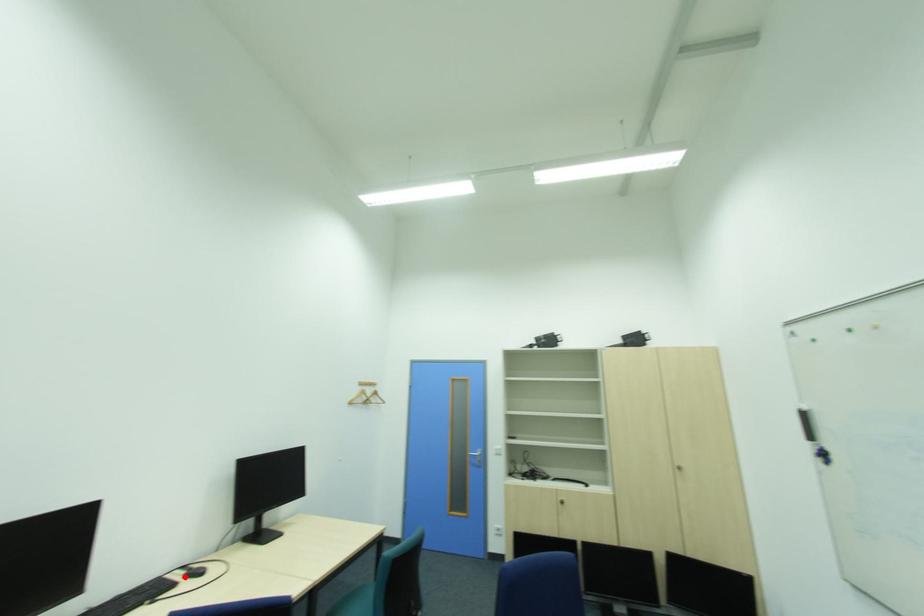
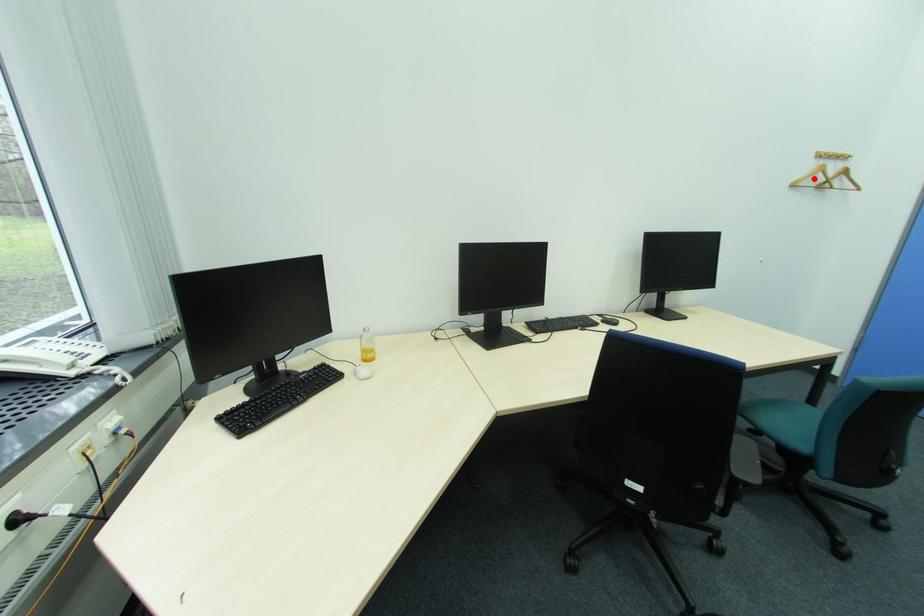
I am providing you with two images of the same scene from different viewpoints. A red point is marked on the first image and another point is marked on the second image. Is the marked point in image1 the same physical position as the marked point in image2?

No